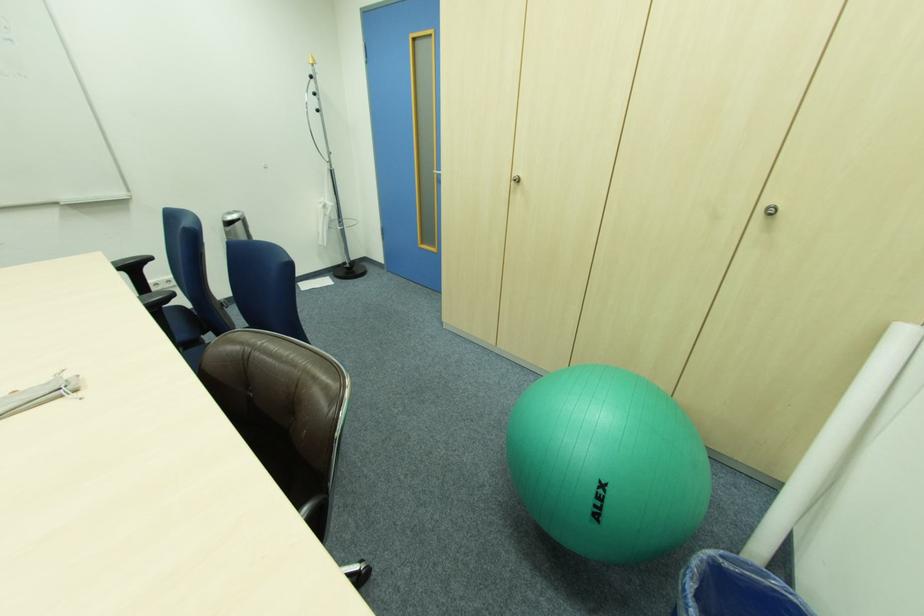
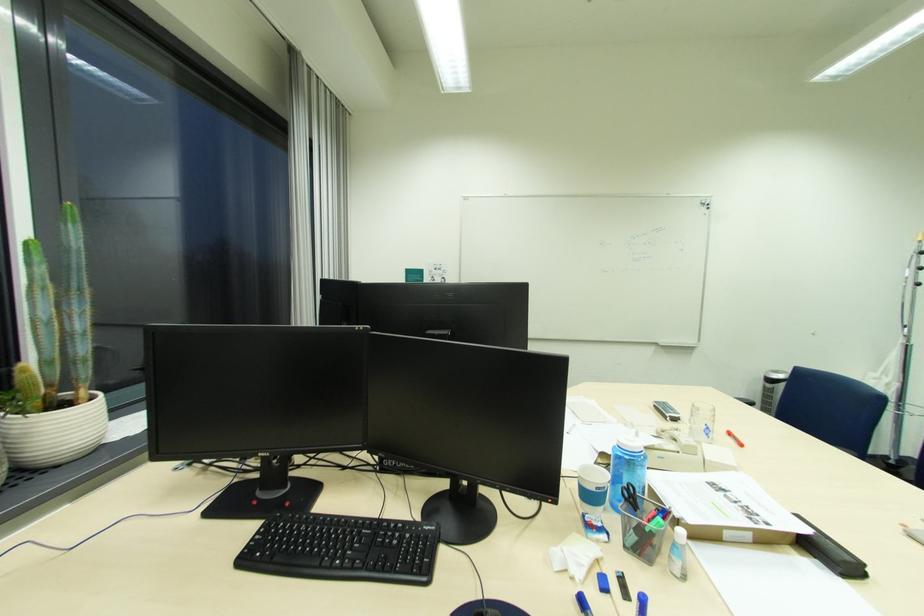
Locate, in the second image, the point that corresponds to (236,215) in the first image.

(782, 373)